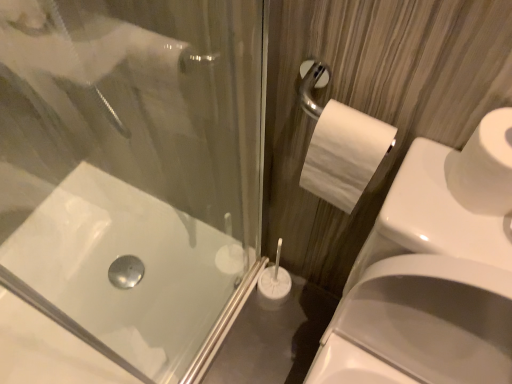
Measure the distance between point (x=462, y=182) and camera.

Point (x=462, y=182) is 21.69 inches away from camera.

How much space does white matte toilet paper at right, which is counted as the 1th toilet paper, starting from the left, occupy horizontally?

white matte toilet paper at right, which is counted as the 1th toilet paper, starting from the left, is 2.41 inches in width.

What are the coordinates of `white glossy sink at lower right` in the screenshot? It's located at pos(431,276).

Which object is wider, white matte toilet paper at right, the 1th toilet paper in the right-to-left sequence, or white glossy sink at lower right?

white glossy sink at lower right.

How different are the orientations of white matte toilet paper at right, the 1th toilet paper in the right-to-left sequence, and white glossy sink at lower right in degrees?

The facing directions of white matte toilet paper at right, the 1th toilet paper in the right-to-left sequence, and white glossy sink at lower right are 0.455 degrees apart.

Considering the positions of objects white matte toilet paper at right, the 2th toilet paper positioned from the left, and white glossy sink at lower right in the image provided, who is behind, white matte toilet paper at right, the 2th toilet paper positioned from the left, or white glossy sink at lower right?

white matte toilet paper at right, the 2th toilet paper positioned from the left, is further away from the camera.

Does point (501, 133) come behind point (408, 292)?

No, (501, 133) is closer to viewer.

Who is smaller, white glossy sink at lower right or white matte toilet paper at right, which is counted as the 2th toilet paper, starting from the right?

Smaller between the two is white matte toilet paper at right, which is counted as the 2th toilet paper, starting from the right.

Is the depth of white glossy sink at lower right greater than that of white matte toilet paper at right, which is counted as the 1th toilet paper, starting from the left?

No, white glossy sink at lower right is closer to the camera.

Is point (442, 362) closer or farther from the camera than point (354, 185)?

Point (442, 362) is farther from the camera than point (354, 185).

From the image's perspective, is white glossy sink at lower right over white matte toilet paper at right, which is counted as the 2th toilet paper, starting from the right?

Actually, white glossy sink at lower right appears below white matte toilet paper at right, which is counted as the 2th toilet paper, starting from the right, in the image.

Consider the image. Would you consider white matte toilet paper at right, the 1th toilet paper in the right-to-left sequence, to be distant from white glossy bath at lower left?

No, white matte toilet paper at right, the 1th toilet paper in the right-to-left sequence, is in close proximity to white glossy bath at lower left.

Is white matte toilet paper at right, the 1th toilet paper in the right-to-left sequence, inside or outside of white glossy bath at lower left?

white matte toilet paper at right, the 1th toilet paper in the right-to-left sequence, is outside white glossy bath at lower left.

I want to click on toilet paper that is the 2nd object located in front of the white glossy bath at lower left, so click(484, 167).

Relative to white matte toilet paper at right, the 1th toilet paper in the right-to-left sequence, is white matte toilet paper at right, which is counted as the 2th toilet paper, starting from the right, in front or behind?

white matte toilet paper at right, which is counted as the 2th toilet paper, starting from the right, is positioned farther from the viewer than white matte toilet paper at right, the 1th toilet paper in the right-to-left sequence.

Between white matte toilet paper at right, which is counted as the 1th toilet paper, starting from the left, and white matte toilet paper at right, the 2th toilet paper positioned from the left, which one has less height?

With less height is white matte toilet paper at right, the 2th toilet paper positioned from the left.

Is white matte toilet paper at right, which is counted as the 2th toilet paper, starting from the right, next to white matte toilet paper at right, the 1th toilet paper in the right-to-left sequence, and touching it?

No, white matte toilet paper at right, which is counted as the 2th toilet paper, starting from the right, is not next to white matte toilet paper at right, the 1th toilet paper in the right-to-left sequence.

From the image's perspective, is white glossy sink at lower right located above white glossy bath at lower left?

Indeed, from the image's perspective, white glossy sink at lower right is shown above white glossy bath at lower left.

Is white glossy sink at lower right inside or outside of white glossy bath at lower left?

white glossy sink at lower right lies outside white glossy bath at lower left.

The width and height of the screenshot is (512, 384). I want to click on sink that appears in front of the white glossy bath at lower left, so click(431, 276).

Which is more to the right, white glossy sink at lower right or white glossy bath at lower left?

Positioned to the right is white glossy sink at lower right.

From the image's perspective, is white glossy bath at lower left located beneath white matte toilet paper at right, which is counted as the 1th toilet paper, starting from the left?

Yes, from the image's perspective, white glossy bath at lower left is below white matte toilet paper at right, which is counted as the 1th toilet paper, starting from the left.

Does white glossy bath at lower left lie in front of white matte toilet paper at right, which is counted as the 2th toilet paper, starting from the right?

That is False.

Does white glossy bath at lower left have a larger size compared to white matte toilet paper at right, which is counted as the 1th toilet paper, starting from the left?

Indeed, white glossy bath at lower left has a larger size compared to white matte toilet paper at right, which is counted as the 1th toilet paper, starting from the left.

Does white glossy bath at lower left have a lesser height compared to white matte toilet paper at right, which is counted as the 2th toilet paper, starting from the right?

Correct, white glossy bath at lower left is not as tall as white matte toilet paper at right, which is counted as the 2th toilet paper, starting from the right.

Considering the sizes of white matte toilet paper at right, the 2th toilet paper positioned from the left, and white matte toilet paper at right, which is counted as the 1th toilet paper, starting from the left, in the image, is white matte toilet paper at right, the 2th toilet paper positioned from the left, bigger or smaller than white matte toilet paper at right, which is counted as the 1th toilet paper, starting from the left,?

Clearly, white matte toilet paper at right, the 2th toilet paper positioned from the left, is smaller in size than white matte toilet paper at right, which is counted as the 1th toilet paper, starting from the left.

Is white matte toilet paper at right, the 1th toilet paper in the right-to-left sequence, not within white matte toilet paper at right, which is counted as the 2th toilet paper, starting from the right?

That's correct, white matte toilet paper at right, the 1th toilet paper in the right-to-left sequence, is outside of white matte toilet paper at right, which is counted as the 2th toilet paper, starting from the right.

Is there a large distance between white matte toilet paper at right, the 2th toilet paper positioned from the left, and white matte toilet paper at right, which is counted as the 2th toilet paper, starting from the right?

They are positioned close to each other.

From the image's perspective, which object appears higher, white matte toilet paper at right, the 2th toilet paper positioned from the left, or white matte toilet paper at right, which is counted as the 2th toilet paper, starting from the right?

white matte toilet paper at right, which is counted as the 2th toilet paper, starting from the right, appears higher in the image.

Where is `the 1st toilet paper behind the white glossy sink at lower right, starting your count from the anchor`? Image resolution: width=512 pixels, height=384 pixels. the 1st toilet paper behind the white glossy sink at lower right, starting your count from the anchor is located at coordinates (484, 167).

Find the location of `sink that appears below the white matte toilet paper at right, which is counted as the 1th toilet paper, starting from the left (from the image's perspective)`. sink that appears below the white matte toilet paper at right, which is counted as the 1th toilet paper, starting from the left (from the image's perspective) is located at coordinates (431, 276).

Estimate the real-world distances between objects in this image. Which object is closer to white matte toilet paper at right, the 2th toilet paper positioned from the left, white matte toilet paper at right, which is counted as the 2th toilet paper, starting from the right, or white glossy sink at lower right?

Based on the image, white matte toilet paper at right, which is counted as the 2th toilet paper, starting from the right, appears to be nearer to white matte toilet paper at right, the 2th toilet paper positioned from the left.

Looking at the image, which one is located further to white glossy bath at lower left, white matte toilet paper at right, which is counted as the 1th toilet paper, starting from the left, or white matte toilet paper at right, the 1th toilet paper in the right-to-left sequence?

white matte toilet paper at right, the 1th toilet paper in the right-to-left sequence.

Based on the photo, based on their spatial positions, is white glossy sink at lower right or white matte toilet paper at right, which is counted as the 1th toilet paper, starting from the left, further from white matte toilet paper at right, the 1th toilet paper in the right-to-left sequence?

Among the two, white glossy sink at lower right is located further to white matte toilet paper at right, the 1th toilet paper in the right-to-left sequence.

Looking at the image, which one is located further to white glossy bath at lower left, white glossy sink at lower right or white matte toilet paper at right, which is counted as the 2th toilet paper, starting from the right?

Among the two, white matte toilet paper at right, which is counted as the 2th toilet paper, starting from the right, is located further to white glossy bath at lower left.

Considering their positions, is white matte toilet paper at right, which is counted as the 1th toilet paper, starting from the left, positioned further to white glossy sink at lower right than white glossy bath at lower left?

white glossy bath at lower left is further to white glossy sink at lower right.

From the image, which object appears to be nearer to white matte toilet paper at right, which is counted as the 1th toilet paper, starting from the left, white glossy sink at lower right or white matte toilet paper at right, the 2th toilet paper positioned from the left?

Based on the image, white matte toilet paper at right, the 2th toilet paper positioned from the left, appears to be nearer to white matte toilet paper at right, which is counted as the 1th toilet paper, starting from the left.

From the picture: Considering their positions, is white matte toilet paper at right, the 2th toilet paper positioned from the left, positioned further to white matte toilet paper at right, which is counted as the 1th toilet paper, starting from the left, than white glossy sink at lower right?

white glossy sink at lower right lies further to white matte toilet paper at right, which is counted as the 1th toilet paper, starting from the left, than the other object.

Considering their positions, is white glossy sink at lower right positioned closer to white matte toilet paper at right, the 2th toilet paper positioned from the left, than white glossy bath at lower left?

Based on the image, white glossy sink at lower right appears to be nearer to white matte toilet paper at right, the 2th toilet paper positioned from the left.

The height and width of the screenshot is (384, 512). I want to click on sink between white glossy bath at lower left and white matte toilet paper at right, the 2th toilet paper positioned from the left, so click(x=431, y=276).

This screenshot has height=384, width=512. Find the location of `toilet paper between white matte toilet paper at right, which is counted as the 1th toilet paper, starting from the left, and white glossy sink at lower right vertically`. toilet paper between white matte toilet paper at right, which is counted as the 1th toilet paper, starting from the left, and white glossy sink at lower right vertically is located at coordinates (484, 167).

In order to click on toilet paper located between white glossy bath at lower left and white glossy sink at lower right in the left-right direction in this screenshot , I will do `click(344, 154)`.

You are a GUI agent. You are given a task and a screenshot of the screen. Output one action in this format:
    pyautogui.click(x=<x>, y=<y>)
    Task: Click on the toilet paper located between white glossy bath at lower left and white matte toilet paper at right, the 2th toilet paper positioned from the left, in the left-right direction
    The height and width of the screenshot is (384, 512).
    Given the screenshot: What is the action you would take?
    pyautogui.click(x=344, y=154)